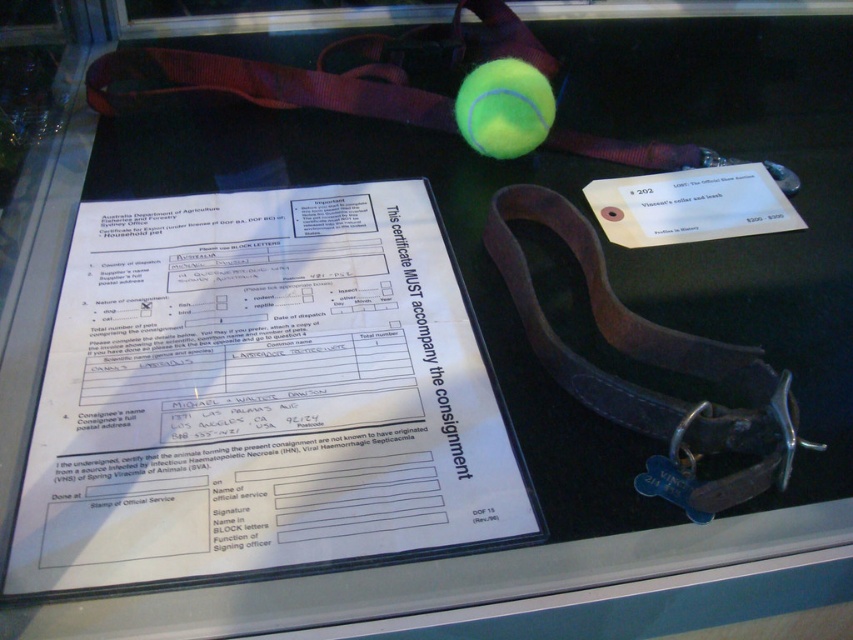
Between point (770, 412) and point (469, 90), which one is positioned in front?

Point (770, 412) is more forward.

Is point (693, 435) farther from camera compared to point (511, 124)?

No, it is not.

Where is `brown leather collar at center`? This screenshot has height=640, width=853. brown leather collar at center is located at coordinates 650,364.